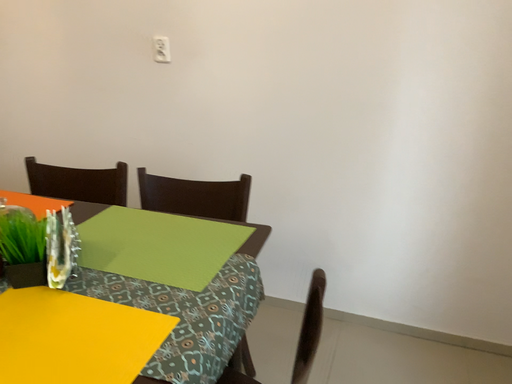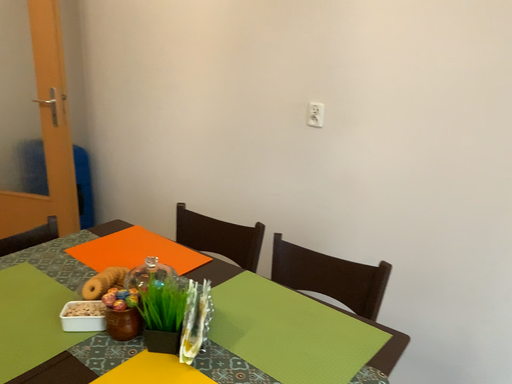
Question: How did the camera likely rotate when shooting the video?

Choices:
 (A) rotated left
 (B) rotated right

Answer: (A)